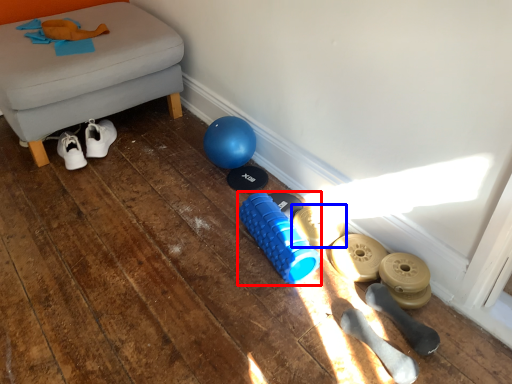
Question: Which point is closer to the camera, dumbbell (highlighted by a red box) or footwear (highlighted by a blue box)?

Choices:
 (A) dumbbell
 (B) footwear

Answer: (A)